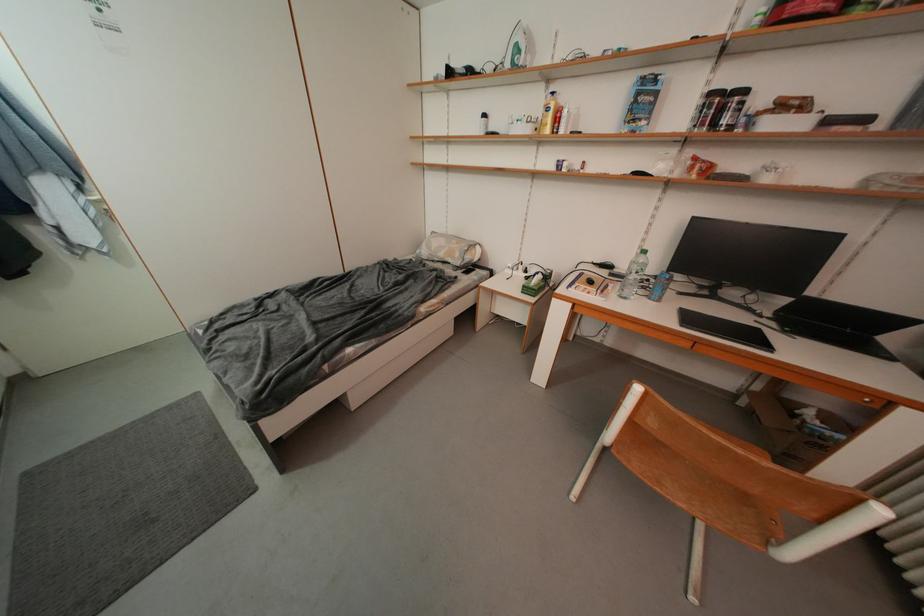
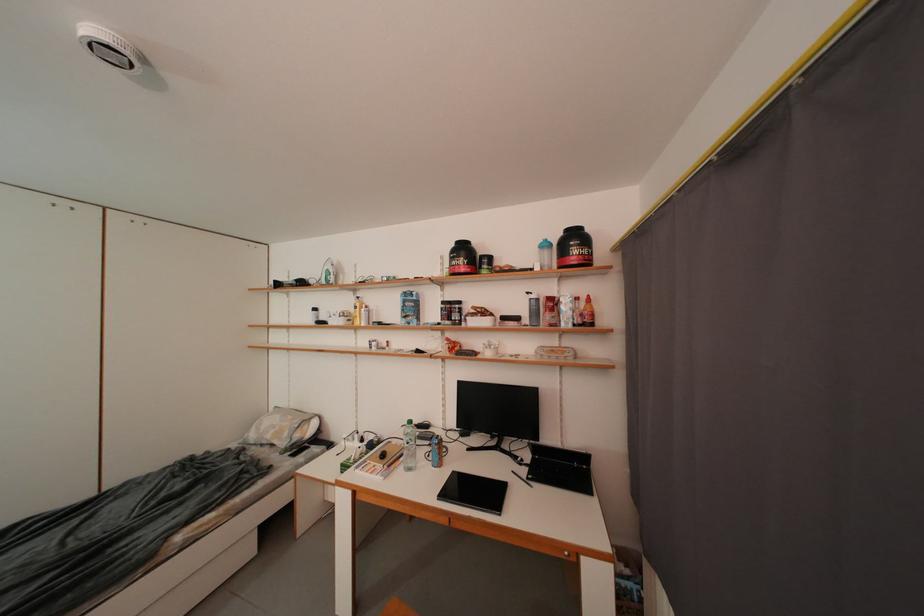
Locate, in the second image, the point that corresponds to point 888,128 in the first image.

(533, 323)